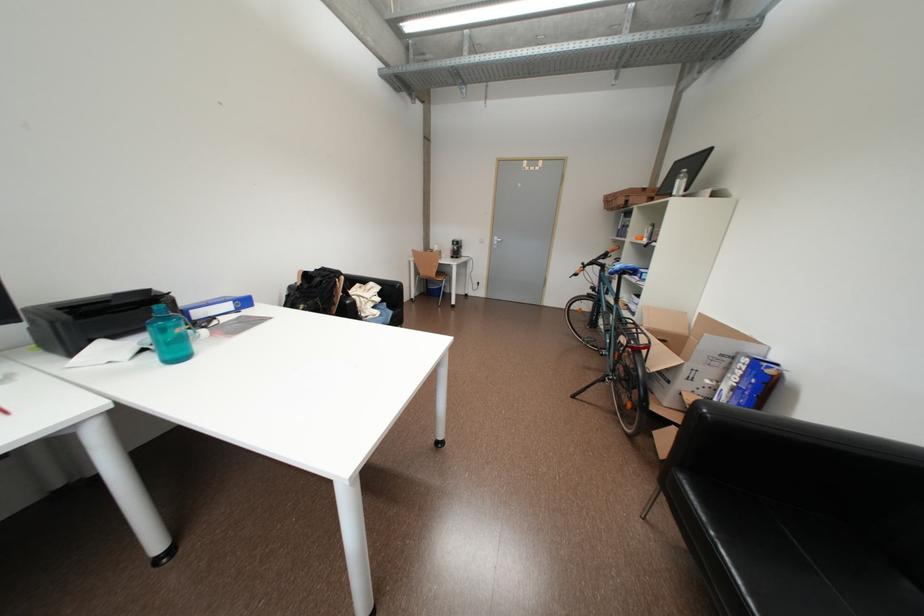
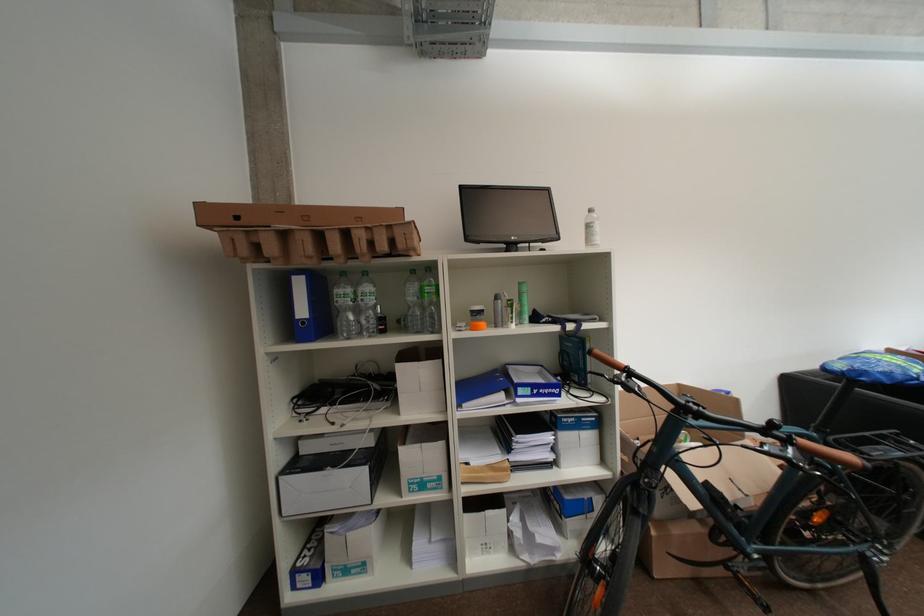
In the second image, find the point that corresponds to point 613,257 in the first image.

(638, 382)